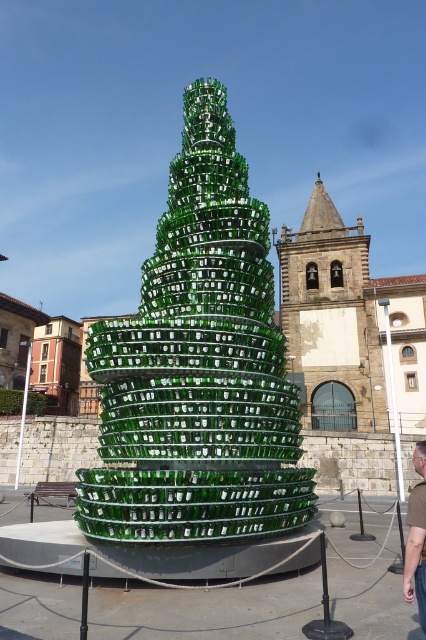
Question: Among these objects, which one is farthest from the camera?

Choices:
 (A) green glass bottle at lower right
 (B) green glass christmas tree at center

Answer: (B)

Question: Is green glass christmas tree at center closer to the viewer compared to green glass bottle at lower right?

Choices:
 (A) yes
 (B) no

Answer: (B)

Question: Is green glass christmas tree at center bigger than green glass bottle at lower right?

Choices:
 (A) no
 (B) yes

Answer: (B)

Question: Among these points, which one is nearest to the camera?

Choices:
 (A) (425, 476)
 (B) (244, 492)

Answer: (A)

Question: Does green glass christmas tree at center appear under green glass bottle at lower right?

Choices:
 (A) no
 (B) yes

Answer: (A)